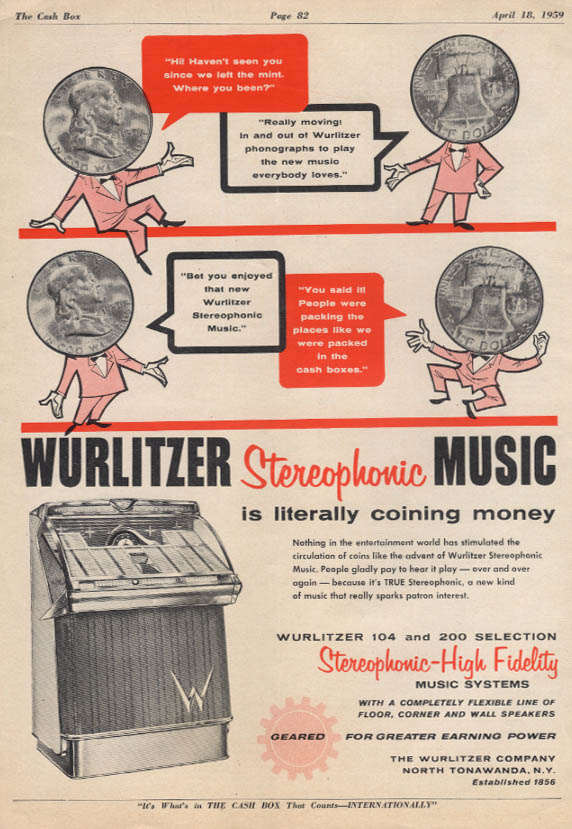
The image size is (572, 829). In order to click on jukebox in this screenshot , I will do `click(139, 608)`.